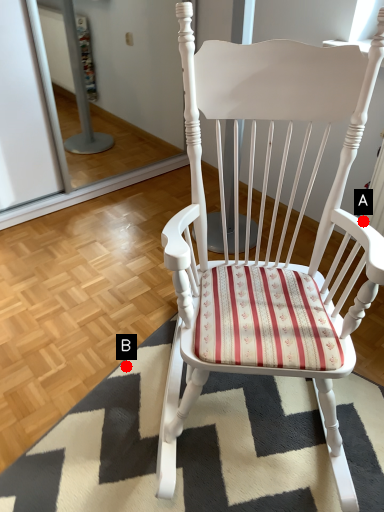
Question: Two points are circled on the image, labeled by A and B beside each circle. Which point is closer to the camera taking this photo?

Choices:
 (A) A is closer
 (B) B is closer

Answer: (A)